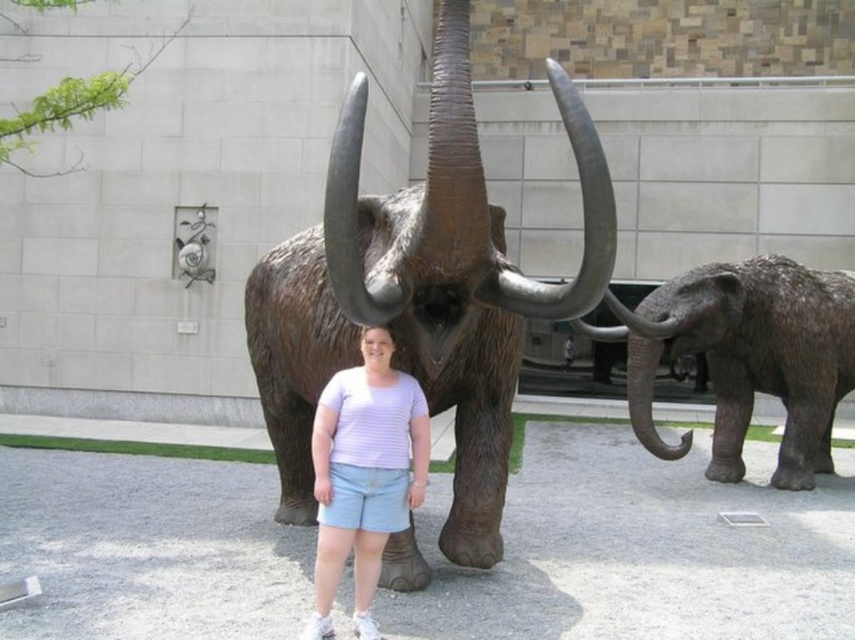
Who is positioned more to the right, rough textured gray elephant at right or white striped shirt at center?

From the viewer's perspective, rough textured gray elephant at right appears more on the right side.

Who is more forward, (786, 417) or (374, 326)?

Positioned in front is point (374, 326).

At what (x,y) coordinates should I click in order to perform the action: click on rough textured gray elephant at right. Please return your answer as a coordinate pair (x, y). This screenshot has width=855, height=640. Looking at the image, I should click on (747, 356).

I want to click on bronze statue of mammoth at center, so click(x=420, y=292).

Based on the photo, is bronze statue of mammoth at center to the left of rough textured gray elephant at right from the viewer's perspective?

Yes, bronze statue of mammoth at center is to the left of rough textured gray elephant at right.

Which is in front, point (429, 152) or point (644, 328)?

Positioned in front is point (429, 152).

The height and width of the screenshot is (640, 855). Identify the location of bronze statue of mammoth at center. (420, 292).

How far apart are bronze statue of mammoth at center and white striped shirt at center?

bronze statue of mammoth at center is 19.71 inches away from white striped shirt at center.

Can you confirm if bronze statue of mammoth at center is positioned above white striped shirt at center?

Yes.

Between point (367, 312) and point (366, 387), which one is positioned behind?

The point (366, 387) is behind.

Identify the location of bronze statue of mammoth at center. This screenshot has width=855, height=640. (420, 292).